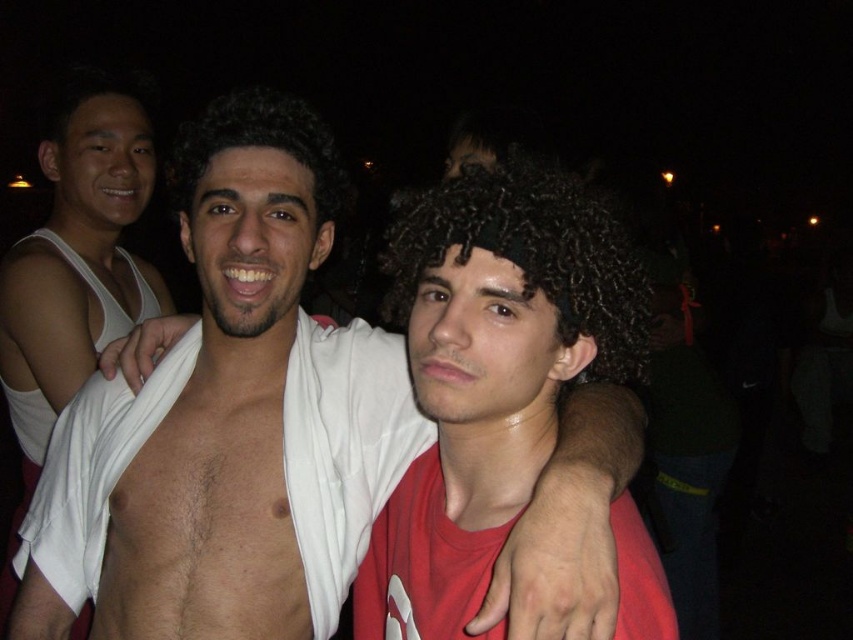
Looking at the image, which object is positioned to the left of the other between the white tank top at left and dark curly hair at center?

The white tank top at left is positioned to the left of the dark curly hair at center.